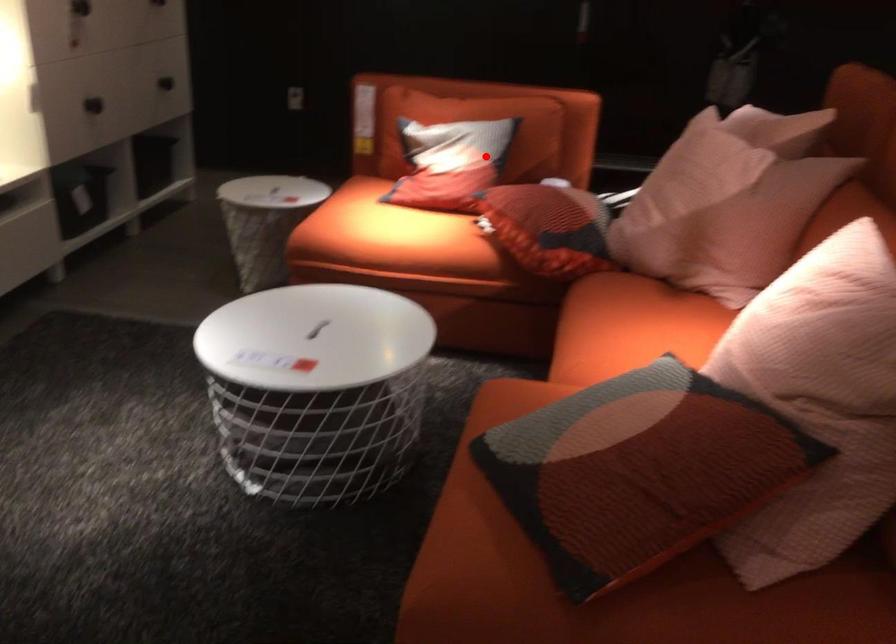
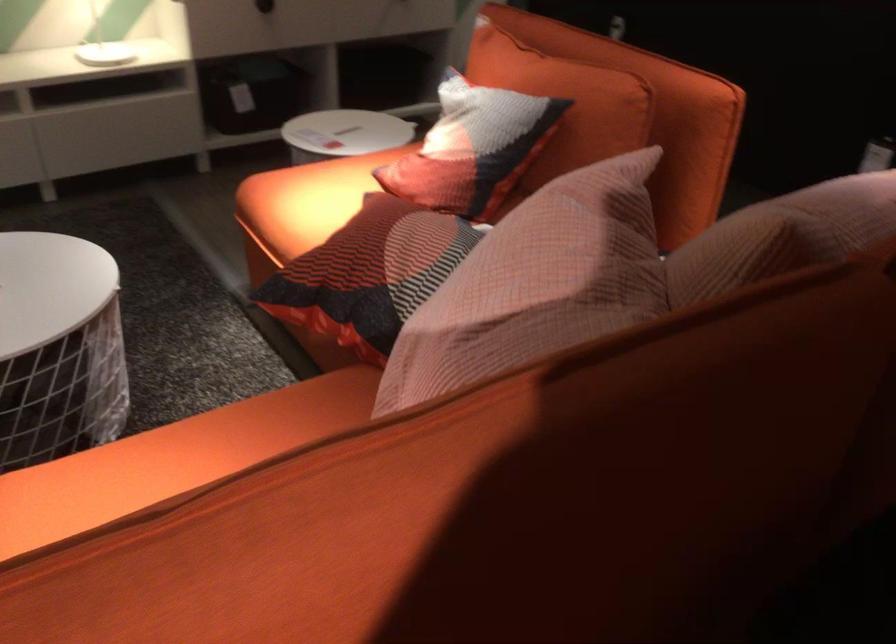
Question: I am providing you with two images of the same scene from different viewpoints. A red point is shown in image1. For the corresponding object point in image2, is it positioned nearer or farther from the camera?

Choices:
 (A) Nearer
 (B) Farther

Answer: (A)